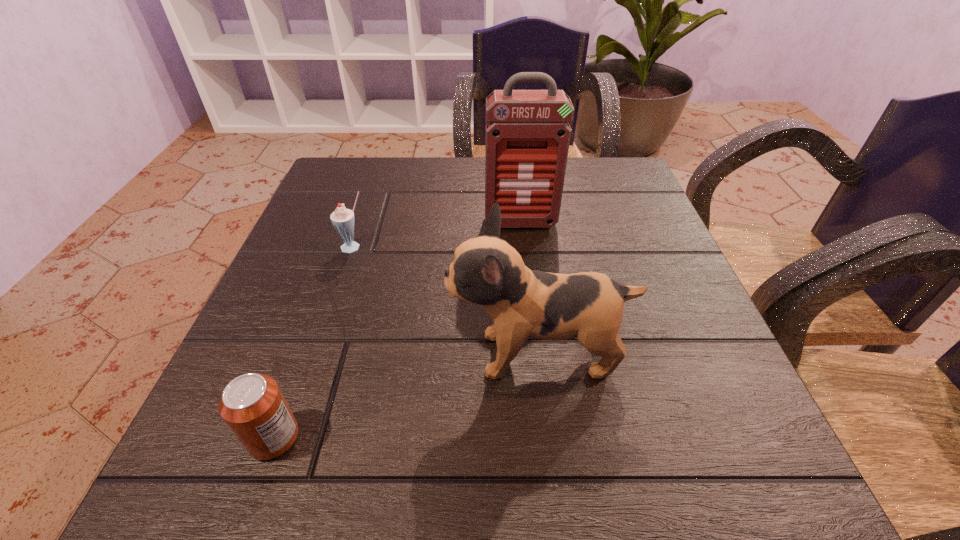
Identify the location of the tallest object. (528, 134).

The width and height of the screenshot is (960, 540). Identify the location of the first-aid kit. (528, 134).

This screenshot has width=960, height=540. I want to click on the third farthest object, so click(487, 271).

Find the location of a particular element. puppy is located at coordinates (487, 271).

What are the coordinates of `milkshake` in the screenshot? It's located at (342, 219).

At what (x,y) coordinates should I click in order to perform the action: click on the nearest object. Please return your answer as a coordinate pair (x, y). Image resolution: width=960 pixels, height=540 pixels. Looking at the image, I should click on (252, 405).

Identify the location of vacant region located on the front-facing side of the tallest object. (535, 350).

The width and height of the screenshot is (960, 540). What are the coordinates of `free point located 0.190m at the face of the second tallest object` in the screenshot? It's located at tap(330, 354).

Locate an element on the screen. free region located at the face of the second tallest object is located at coordinates (387, 354).

What are the coordinates of `vacant space located at the face of the second tallest object` in the screenshot? It's located at [249, 354].